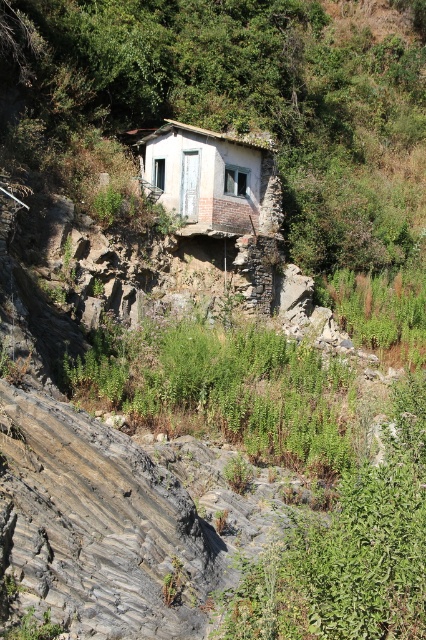
Is green leafy plants at center smaller than white weathered hut at center?

No.

Does green leafy plants at center have a greater width compared to white weathered hut at center?

Yes, green leafy plants at center is wider than white weathered hut at center.

Between point (158, 332) and point (180, 154), which one is positioned in front?

Point (158, 332)

Identify the location of green leafy plants at center. (224, 387).